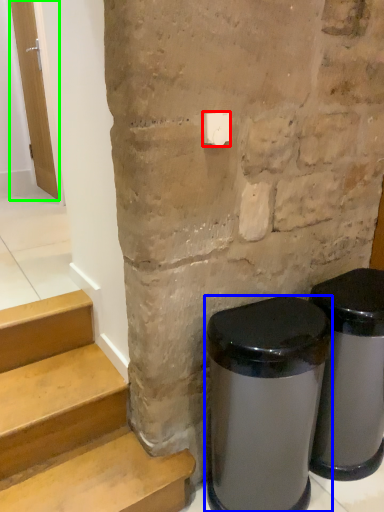
Question: Which is nearer to the light switch (highlighted by a red box)? waste container (highlighted by a blue box) or door (highlighted by a green box).

Choices:
 (A) waste container
 (B) door

Answer: (A)